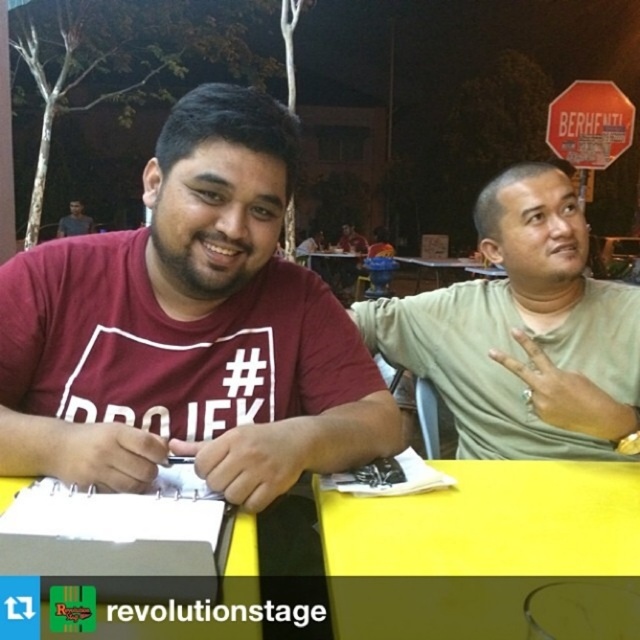
Can you confirm if matte khaki shirt at right is thinner than yellow matte table at center?

No.

Who is more distant from viewer, (x=474, y=301) or (x=548, y=604)?

Point (x=474, y=301)

You are a GUI agent. You are given a task and a screenshot of the screen. Output one action in this format:
    pyautogui.click(x=<x>, y=<y>)
    Task: Click on the matte khaki shirt at right
    The width and height of the screenshot is (640, 640).
    Given the screenshot: What is the action you would take?
    pyautogui.click(x=524, y=332)

Describe the element at coordinates (189, 328) in the screenshot. I see `maroon t-shirt at center` at that location.

Does point (202, 305) lie in front of point (593, 106)?

Yes, point (202, 305) is in front of point (593, 106).

This screenshot has width=640, height=640. In order to click on maroon t-shirt at center in this screenshot , I will do `click(189, 328)`.

Is yellow matte table at center taller than matte black shirt at upper left?

Incorrect, yellow matte table at center's height is not larger of matte black shirt at upper left's.

The width and height of the screenshot is (640, 640). Find the location of `yellow matte table at center`. yellow matte table at center is located at coordinates (486, 554).

Between point (500, 538) and point (74, 204), which one is positioned behind?

Point (74, 204)

At what (x,y) coordinates should I click in order to perform the action: click on yellow matte table at center. Please return your answer as a coordinate pair (x, y). Looking at the image, I should click on pyautogui.click(x=486, y=554).